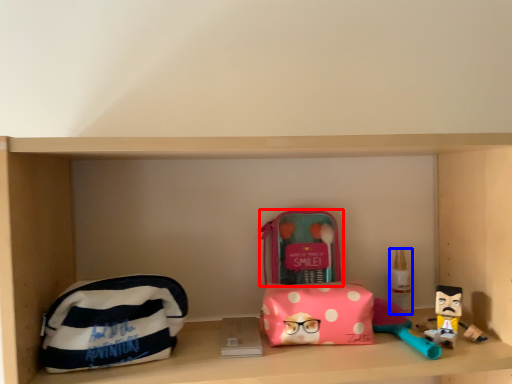
Question: Which object is further to the camera taking this photo, kit (highlighted by a red box) or toiletry (highlighted by a blue box)?

Choices:
 (A) kit
 (B) toiletry

Answer: (B)